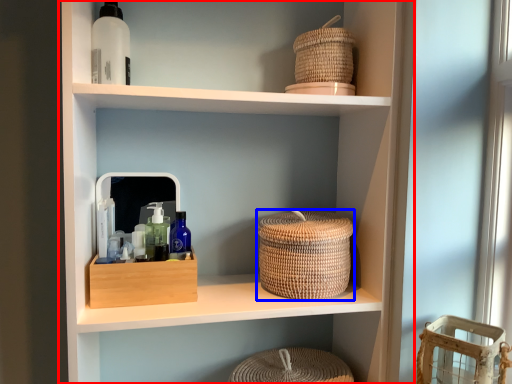
Question: Which of the following is the farthest to the observer, shelf (highlighted by a red box) or basket (highlighted by a blue box)?

Choices:
 (A) shelf
 (B) basket

Answer: (B)